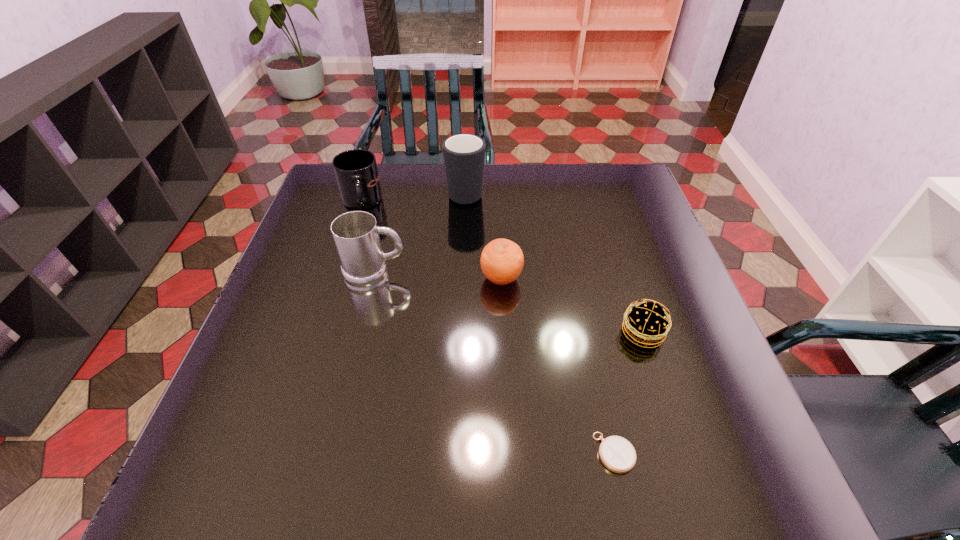
Where is `free spot between the nearest mug and the shortest object`? free spot between the nearest mug and the shortest object is located at coordinates (494, 362).

Locate an element on the screen. vacant area between the nearest mug and the patty is located at coordinates (509, 302).

At what (x,y) coordinates should I click in order to perform the action: click on free space between the fifth object from left to right and the rightmost object. Please return your answer as a coordinate pair (x, y). Looking at the image, I should click on (629, 393).

The width and height of the screenshot is (960, 540). In order to click on vacant region between the rightmost object and the rightmost mug in this screenshot , I will do `click(554, 262)`.

At what (x,y) coordinates should I click in order to perform the action: click on empty space between the nearest mug and the fifth tallest object. Please return your answer as a coordinate pair (x, y). Looking at the image, I should click on (509, 302).

Where is `free space between the nearest mug and the orange`? The image size is (960, 540). free space between the nearest mug and the orange is located at coordinates (438, 275).

You are a GUI agent. You are given a task and a screenshot of the screen. Output one action in this format:
    pyautogui.click(x=<x>, y=<y>)
    Task: Click on the vacant region between the rightmost mug and the fifth tallest object
    This screenshot has height=540, width=960.
    Given the screenshot: What is the action you would take?
    pyautogui.click(x=554, y=262)

The image size is (960, 540). What are the coordinates of `vacant area between the nearest mug and the orange` in the screenshot? It's located at (438, 275).

The height and width of the screenshot is (540, 960). Find the location of `vacant region between the nearest mug and the compass`. vacant region between the nearest mug and the compass is located at coordinates (494, 362).

This screenshot has width=960, height=540. Find the location of `object that is the closest to the patty`. object that is the closest to the patty is located at coordinates (617, 454).